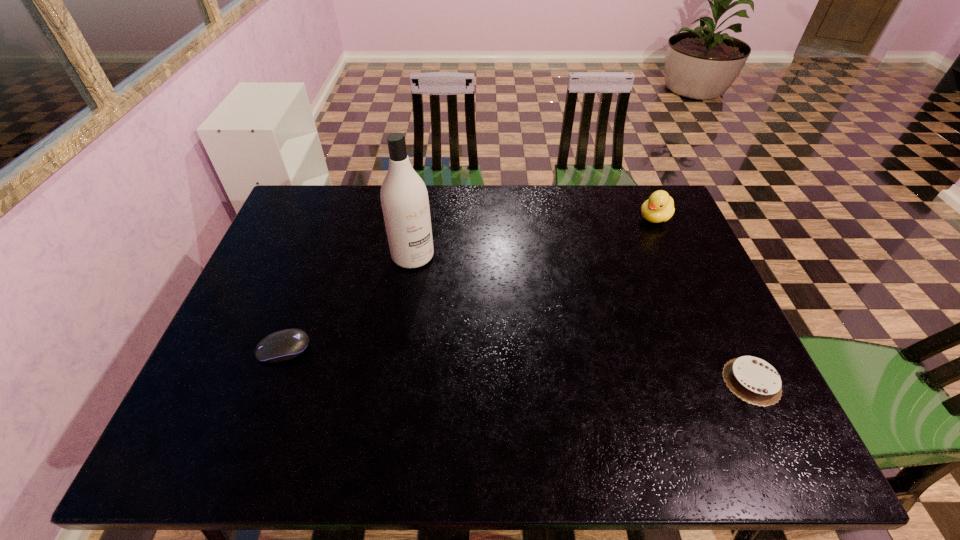
Where is `object located in the far right corner section of the desktop`? The image size is (960, 540). object located in the far right corner section of the desktop is located at coordinates (659, 207).

Identify the location of object present at the near right corner. (753, 380).

In the image, there is a desktop. Where is `blank space at the far edge`? The width and height of the screenshot is (960, 540). blank space at the far edge is located at coordinates (372, 214).

Identify the location of vacant space at the near edge of the desktop. (550, 402).

You are a GUI agent. You are given a task and a screenshot of the screen. Output one action in this format:
    pyautogui.click(x=<x>, y=<y>)
    Task: Click on the free space at the left edge of the desktop
    This screenshot has width=960, height=540.
    Given the screenshot: What is the action you would take?
    pyautogui.click(x=317, y=232)

This screenshot has height=540, width=960. In the image, there is a desktop. In order to click on vacant space at the right edge in this screenshot , I will do `click(654, 289)`.

Find the location of a particular element. This screenshot has height=540, width=960. free spot at the far left corner of the desktop is located at coordinates (306, 195).

Image resolution: width=960 pixels, height=540 pixels. I want to click on free space between the shortest object and the third tallest object, so click(517, 365).

The image size is (960, 540). In order to click on free space between the third object from right to left and the shortest object in this screenshot , I will do `click(582, 319)`.

Find the location of a particular element. free space that is in between the shampoo and the computer mouse is located at coordinates (348, 302).